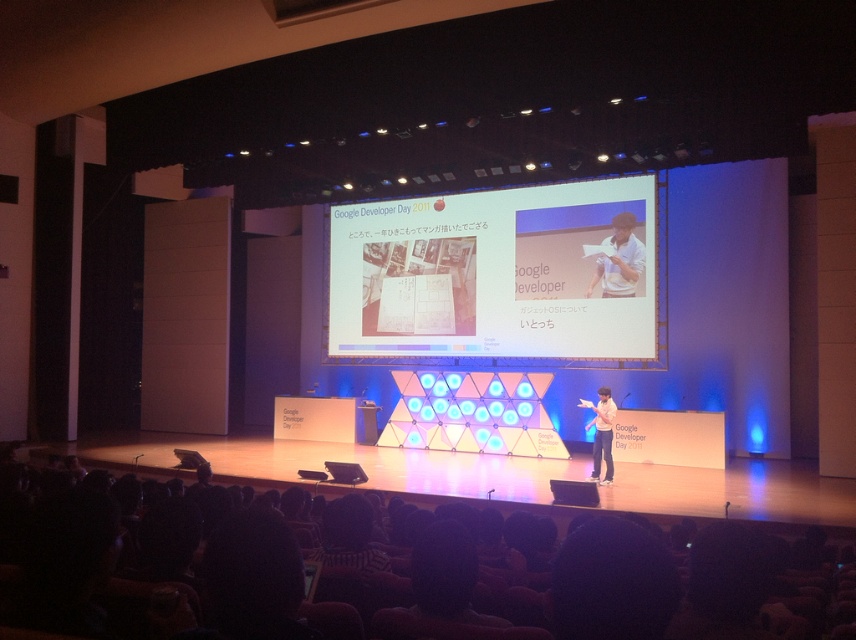
Question: Estimate the real-world distances between objects in this image. Which object is farther from the white shirt at center?

Choices:
 (A) white matte projector screen at center
 (B) black casual wear at center
 (C) white cotton shirt at center

Answer: (B)

Question: Is black casual wear at center to the right of white cotton shirt at center from the viewer's perspective?

Choices:
 (A) yes
 (B) no

Answer: (B)

Question: Which point appears farthest from the camera in this image?

Choices:
 (A) (792, 618)
 (B) (629, 275)
 (C) (599, 406)

Answer: (B)

Question: Which of these objects is positioned farthest from the white shirt at center?

Choices:
 (A) white cotton shirt at center
 (B) matte black laptop at center

Answer: (A)

Question: Is black casual wear at center bigger than white cotton shirt at center?

Choices:
 (A) no
 (B) yes

Answer: (A)

Question: Is white cotton shirt at center bigger than matte black laptop at center?

Choices:
 (A) yes
 (B) no

Answer: (A)